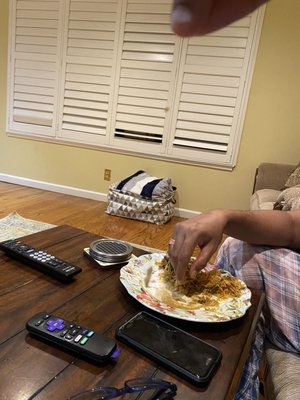
This screenshot has height=400, width=300. Find the location of `plate`. plate is located at coordinates (191, 316).